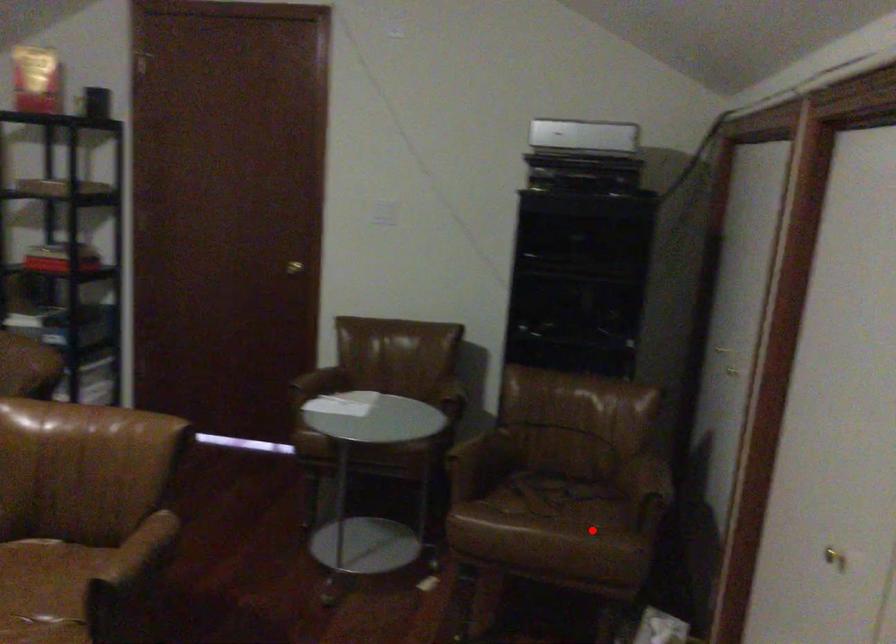
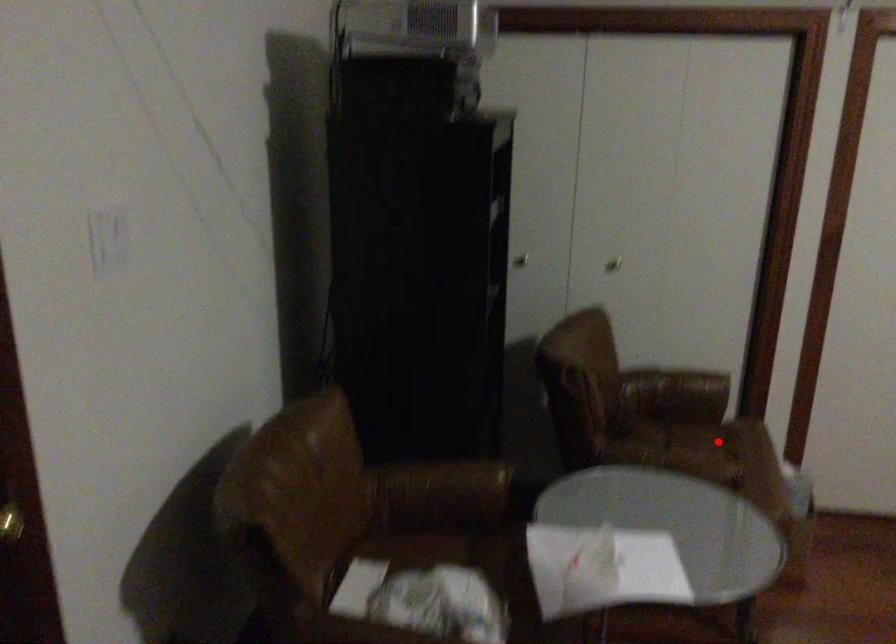
I am providing you with two images of the same scene from different viewpoints. A red point is marked on the first image and another point is marked on the second image. Do the highlighted points in image1 and image2 indicate the same real-world spot?

Yes